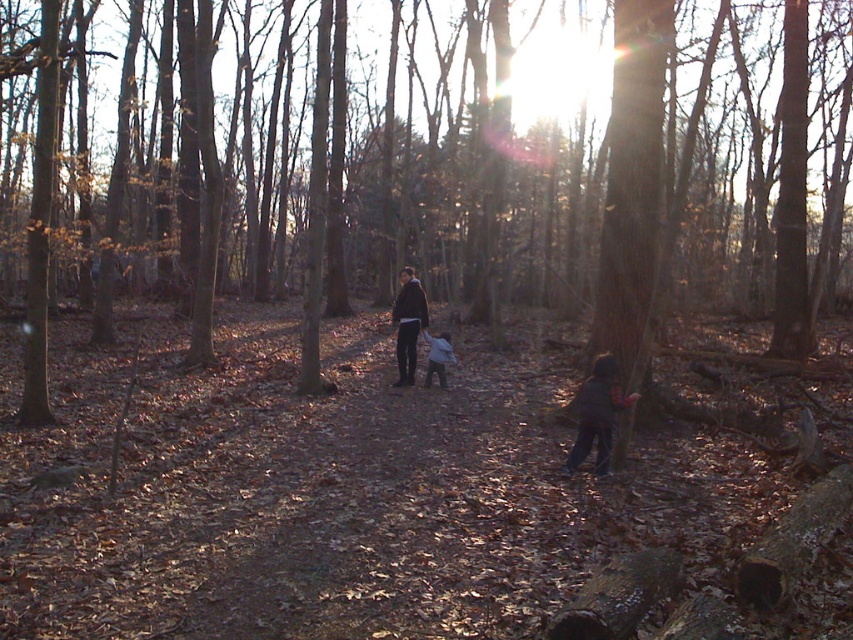
Question: Does dark blue fleece jacket at lower right have a larger size compared to light blue fabric at center?

Choices:
 (A) yes
 (B) no

Answer: (B)

Question: Does dark blue fleece jacket at lower right have a larger size compared to light blue fabric at center?

Choices:
 (A) no
 (B) yes

Answer: (A)

Question: Is dark blue fleece jacket at lower right smaller than light blue fabric at center?

Choices:
 (A) yes
 (B) no

Answer: (A)

Question: Which object appears closest to the camera in this image?

Choices:
 (A) dark blue jacket at center
 (B) light blue fabric at center
 (C) brown rough tree at center
 (D) dark blue fleece jacket at lower right

Answer: (C)

Question: Which is farther from the brown rough tree at center?

Choices:
 (A) dark blue fleece jacket at lower right
 (B) dark blue jacket at center
 (C) light blue fabric at center

Answer: (A)

Question: Which is nearer to the light blue fabric at center?

Choices:
 (A) brown rough tree at center
 (B) dark blue fleece jacket at lower right

Answer: (B)